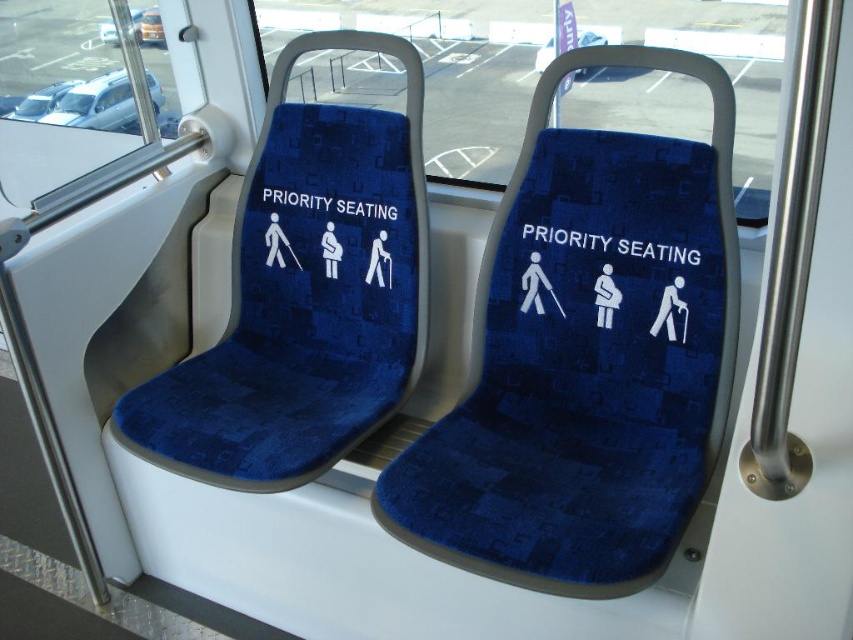
You are a passenger on a bus and need to reach the priority seating area. You see a metallic silver car at upper left and blue fabric priority seating at center. Which object is closer to the left side of the bus?

The metallic silver car at upper left is positioned on the left side of blue fabric priority seating at center, so the metallic silver car at upper left is closer to the left side of the bus.

In the scene shown: You are a passenger on a bus and need to reach the blue fabric priority seating at center. There is a metallic silver car at upper left in your path. Can you walk around it? Explain why or why not based on their positions.

The blue fabric priority seating at center is behind the metallic silver car at upper left, meaning the car is blocking the direct path to the seating. Since the car is in front of the seating from your perspective, you would need to navigate around it to reach the priority seating.

In the scene shown: You are a passenger in a public transportation vehicle and need to reach the blue fabric priority seating at center from the metallic silver car at upper left. Given that the minimum distance required to safely navigate is 4 feet, will you be able to reach the seat comfortably?

The metallic silver car at upper left is 4.11 feet from the blue fabric priority seating at center. Since 4.11 feet is greater than the minimum required 4 feet, you will be able to reach the seat comfortably.